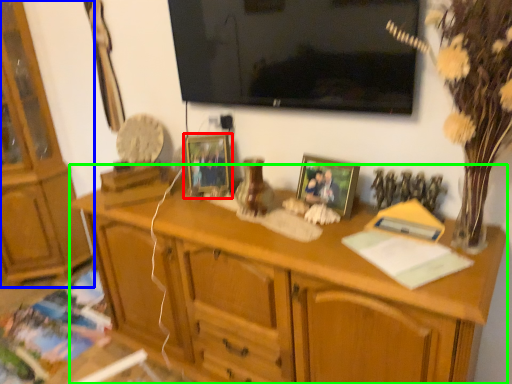
Question: Estimate the real-world distances between objects in this image. Which object is closer to picture frame (highlighted by a red box), cabinetry (highlighted by a blue box) or desk (highlighted by a green box)?

Choices:
 (A) cabinetry
 (B) desk

Answer: (B)